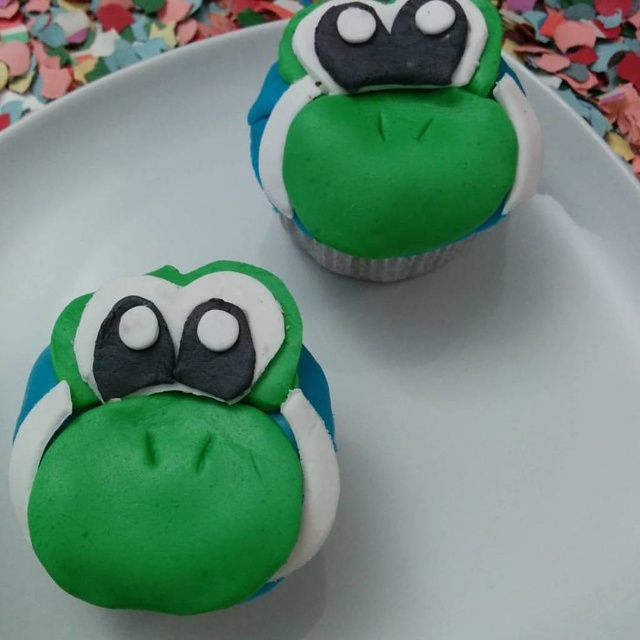
Question: Is green matte cupcake at center thinner than green matte cupcake at upper center?

Choices:
 (A) yes
 (B) no

Answer: (B)

Question: Can you confirm if green matte cupcake at center is bigger than green matte cupcake at upper center?

Choices:
 (A) no
 (B) yes

Answer: (B)

Question: Does green matte cupcake at center appear on the left side of green matte cupcake at upper center?

Choices:
 (A) no
 (B) yes

Answer: (B)

Question: Which of the following is the farthest from the observer?

Choices:
 (A) green matte cupcake at upper center
 (B) green matte cupcake at center

Answer: (A)

Question: Which point is closer to the camera?

Choices:
 (A) (422, 44)
 (B) (97, 348)

Answer: (B)